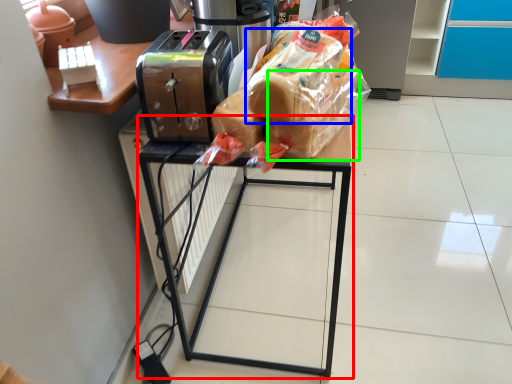
Question: Which is farther away from furniture (highlighted by a red box)? bread (highlighted by a blue box) or bread (highlighted by a green box)?

Choices:
 (A) bread
 (B) bread

Answer: (B)